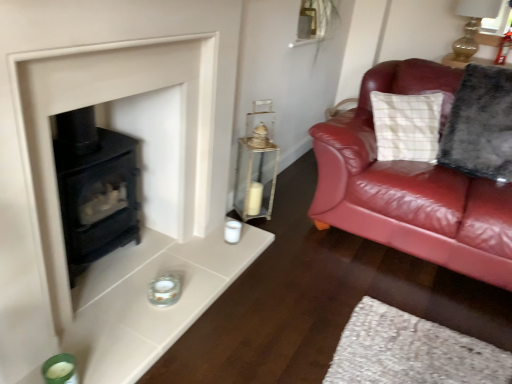
From a real-world perspective, what is the 2D location of a free space above matte black stove at lower left? Please provide its 2D coordinates.

[(0.224, -0.001)]